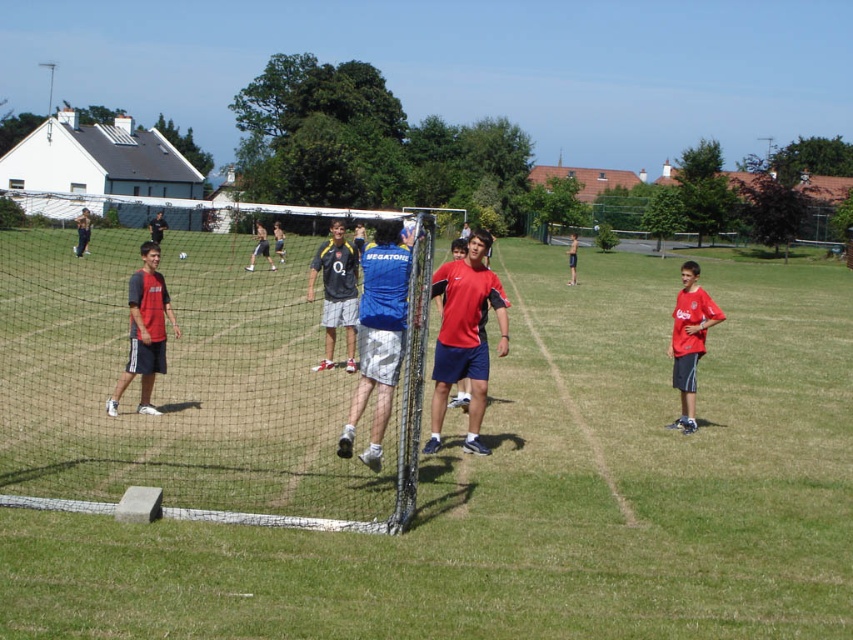
Is blue jersey at center thinner than red matte shirt at right?

Yes, blue jersey at center is thinner than red matte shirt at right.

Can you confirm if blue jersey at center is positioned above red matte shirt at right?

Incorrect, blue jersey at center is not positioned above red matte shirt at right.

Find the location of a particular element. blue jersey at center is located at coordinates (379, 332).

This screenshot has width=853, height=640. Identify the location of blue jersey at center. point(379,332).

Describe the element at coordinates (194, 380) in the screenshot. I see `black mesh net at center` at that location.

Does point (241, 493) come in front of point (372, 349)?

Yes, point (241, 493) is closer to viewer.

Locate an element on the screen. black mesh net at center is located at coordinates (194, 380).

Is point (225, 300) positioned behind point (575, 234)?

No, (225, 300) is in front of (575, 234).

Who is positioned more to the left, black mesh net at center or red matte shirt at center?

black mesh net at center is more to the left.

Locate an element on the screen. The width and height of the screenshot is (853, 640). black mesh net at center is located at coordinates click(194, 380).